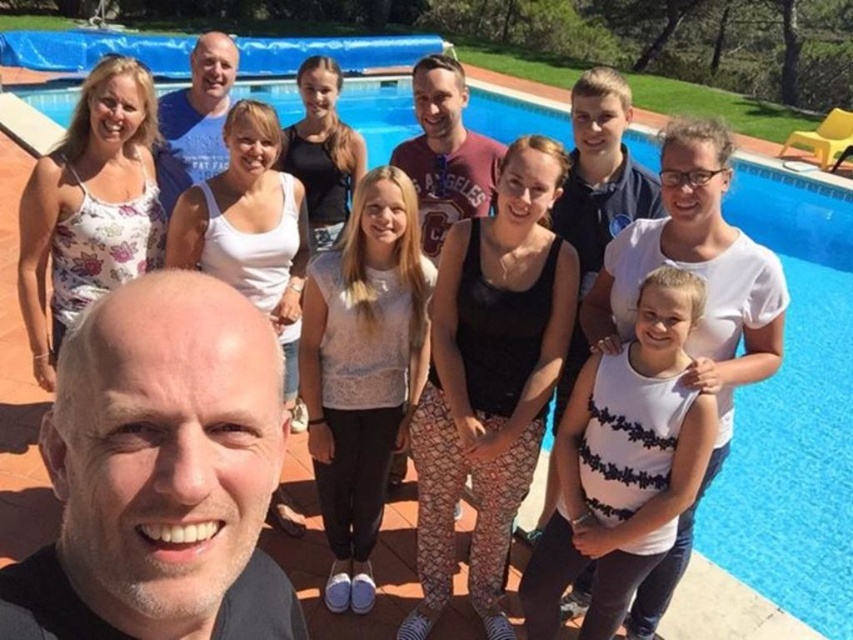
Does point (654, 328) come in front of point (335, 557)?

Yes.

Is point (585, 625) positioned before point (346, 520)?

That is True.

Find the location of a particular element. The height and width of the screenshot is (640, 853). white dotted tank top at center is located at coordinates (624, 464).

Who is positioned more to the left, matte red t-shirt at center or blue cotton t-shirt at center?

blue cotton t-shirt at center is more to the left.

This screenshot has width=853, height=640. What are the coordinates of `matte red t-shirt at center` in the screenshot? It's located at (445, 152).

Who is more distant from viewer, (207, 538) or (173, 189)?

Point (173, 189)

Is smooth skin face at lower left to the right of blue cotton t-shirt at center from the viewer's perspective?

Correct, you'll find smooth skin face at lower left to the right of blue cotton t-shirt at center.

The height and width of the screenshot is (640, 853). What do you see at coordinates (160, 474) in the screenshot? I see `smooth skin face at lower left` at bounding box center [160, 474].

Identify the location of smooth skin face at lower left. (160, 474).